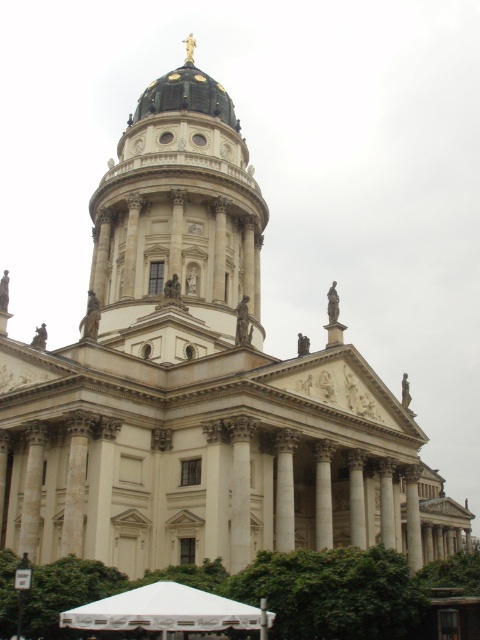
Question: Does black dome at center have a greater width compared to white fabric canopy at lower center?

Choices:
 (A) yes
 (B) no

Answer: (A)

Question: Which point is closer to the camera?

Choices:
 (A) white fabric canopy at lower center
 (B) black dome at center

Answer: (A)

Question: Can you confirm if black dome at center is positioned to the left of white fabric canopy at lower center?

Choices:
 (A) yes
 (B) no

Answer: (A)

Question: Is black dome at center smaller than white fabric canopy at lower center?

Choices:
 (A) no
 (B) yes

Answer: (A)